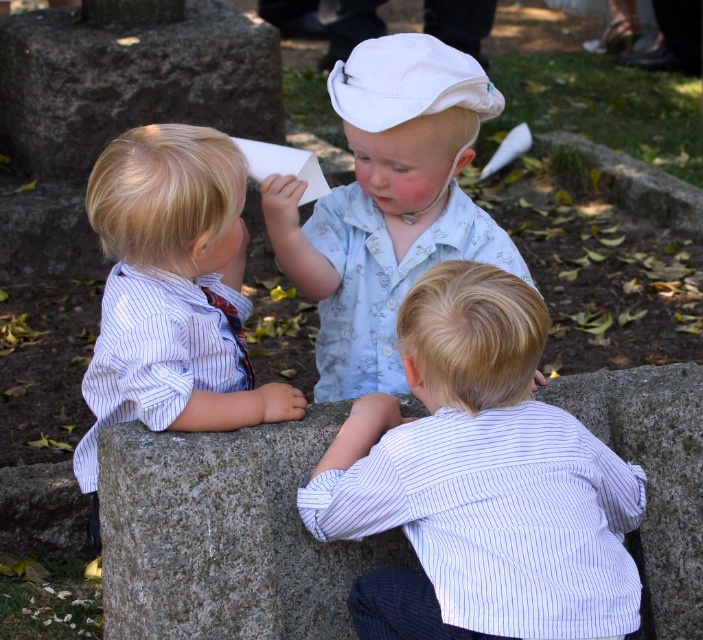
You are standing in a park and see three children sitting on a stone bench. The children are wearing a white striped shirt at center, a blue striped shirt on the left, and a light blue patterned shirt on the right. Which child is sitting in the middle?

The child wearing the white striped shirt at center is sitting in the middle.

You are a photographer taking a picture of the white striped shirt at center and the gray granite stone at center. Based on their positions, which object should you focus on first if you want to capture both clearly in the same frame?

The white striped shirt at center is above the gray granite stone at center, so you should focus on the gray granite stone at center first since it is closer to the camera and the shirt is further away, ensuring both are in focus.